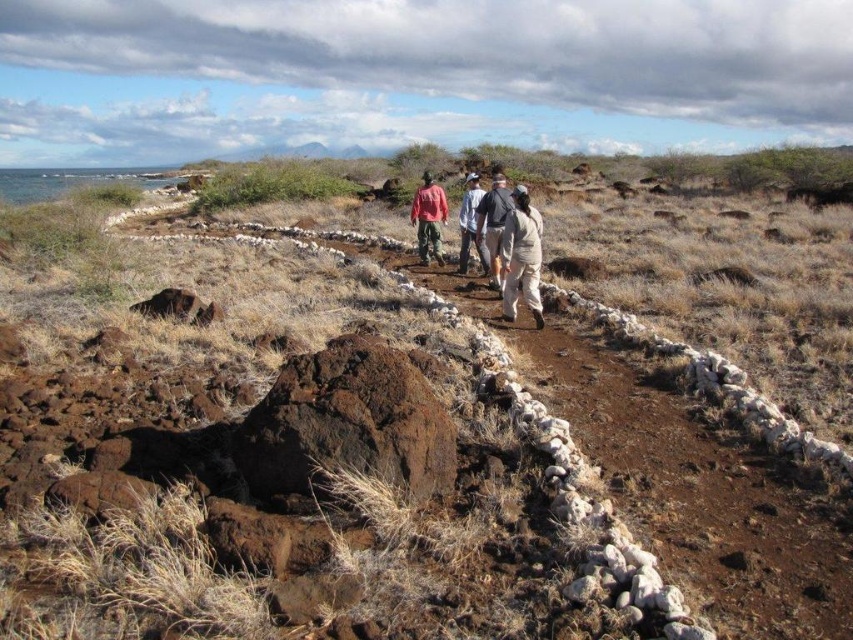
Does tan fabric pants at center appear on the left side of light beige uniform at center?

Incorrect, tan fabric pants at center is not on the left side of light beige uniform at center.

Between tan fabric pants at center and light beige uniform at center, which one has less height?

→ tan fabric pants at center

Which is behind, point (531, 273) or point (476, 250)?

The point (476, 250) is more distant.

You are a GUI agent. You are given a task and a screenshot of the screen. Output one action in this format:
    pyautogui.click(x=<x>, y=<y>)
    Task: Click on the tan fabric pants at center
    This screenshot has height=640, width=853.
    Given the screenshot: What is the action you would take?
    pyautogui.click(x=521, y=257)

Can you confirm if tan fabric pants at center is bigger than light gray fabric pants at center?

Correct, tan fabric pants at center is larger in size than light gray fabric pants at center.

Which is below, tan fabric pants at center or light gray fabric pants at center?

Positioned lower is tan fabric pants at center.

You are a GUI agent. You are given a task and a screenshot of the screen. Output one action in this format:
    pyautogui.click(x=<x>, y=<y>)
    Task: Click on the tan fabric pants at center
    
    Given the screenshot: What is the action you would take?
    [521, 257]

Is matte red shirt at center further to camera compared to light beige uniform at center?

That is True.

The height and width of the screenshot is (640, 853). What do you see at coordinates (428, 218) in the screenshot?
I see `matte red shirt at center` at bounding box center [428, 218].

You are a GUI agent. You are given a task and a screenshot of the screen. Output one action in this format:
    pyautogui.click(x=<x>, y=<y>)
    Task: Click on the matte red shirt at center
    
    Given the screenshot: What is the action you would take?
    pyautogui.click(x=428, y=218)

At what (x,y) coordinates should I click in order to perform the action: click on matte red shirt at center. Please return your answer as a coordinate pair (x, y). Looking at the image, I should click on (428, 218).